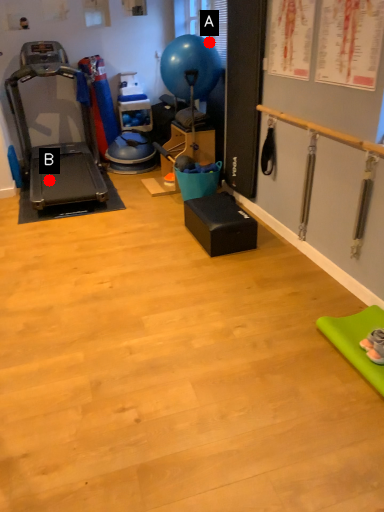
Question: Two points are circled on the image, labeled by A and B beside each circle. Among these points, which one is farthest from the camera?

Choices:
 (A) A is further
 (B) B is further

Answer: (B)